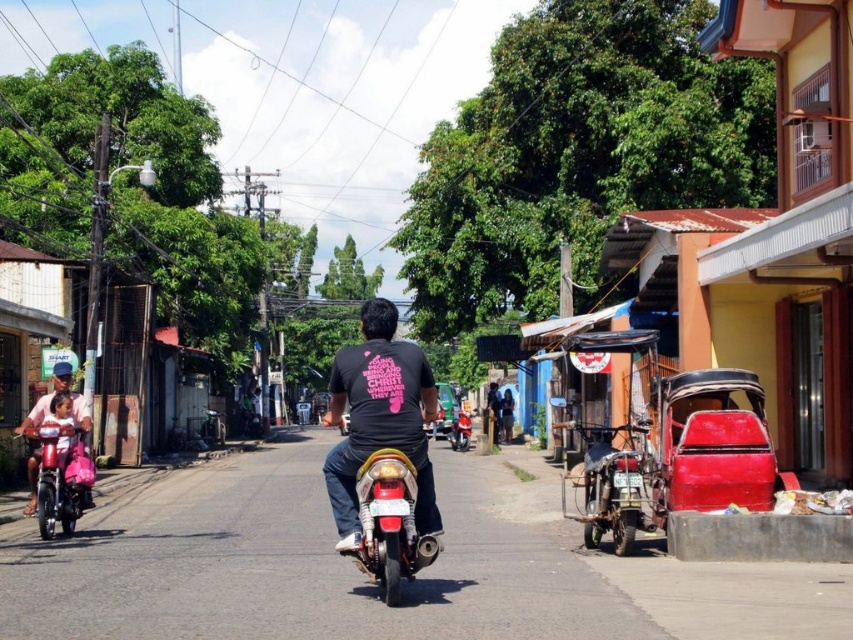
Question: Does metallic pink scooter at lower left have a smaller size compared to metallic red motorcycle at center?

Choices:
 (A) no
 (B) yes

Answer: (B)

Question: Which object appears closest to the camera in this image?

Choices:
 (A) black matte shirt at center
 (B) metallic pink scooter at lower left
 (C) metallic red motorcycle at center

Answer: (A)

Question: Which of the following is the closest to the observer?

Choices:
 (A) (91, 483)
 (B) (396, 577)

Answer: (B)

Question: Which of the following is the closest to the observer?

Choices:
 (A) (422, 566)
 (B) (50, 490)
 (C) (461, 442)
 (D) (364, 392)

Answer: (D)

Question: Where is shiny chrome motorcycle at center located in relation to metallic red motorcycle at center in the image?

Choices:
 (A) right
 (B) left

Answer: (B)

Question: Can you confirm if black matte shirt at center is thinner than shiny chrome motorcycle at center?

Choices:
 (A) yes
 (B) no

Answer: (B)